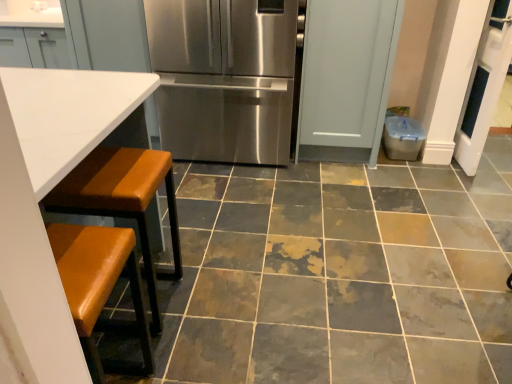
Question: Considering the relative sizes of brown leather stool at lower left and white leather table at left in the image provided, is brown leather stool at lower left shorter than white leather table at left?

Choices:
 (A) yes
 (B) no

Answer: (A)

Question: Is brown leather stool at lower left to the left of white leather table at left from the viewer's perspective?

Choices:
 (A) no
 (B) yes

Answer: (A)

Question: Is brown leather stool at lower left aimed at white leather table at left?

Choices:
 (A) no
 (B) yes

Answer: (B)

Question: Is brown leather stool at lower left smaller than white leather table at left?

Choices:
 (A) no
 (B) yes

Answer: (B)

Question: Is brown leather stool at lower left touching white leather table at left?

Choices:
 (A) no
 (B) yes

Answer: (A)

Question: Considering the positions of stainless steel refrigerator at center and white leather table at left in the image, is stainless steel refrigerator at center wider or thinner than white leather table at left?

Choices:
 (A) wide
 (B) thin

Answer: (B)

Question: Looking at the image, does stainless steel refrigerator at center seem bigger or smaller compared to white leather table at left?

Choices:
 (A) small
 (B) big

Answer: (B)

Question: From a real-world perspective, is stainless steel refrigerator at center positioned above or below white leather table at left?

Choices:
 (A) below
 (B) above

Answer: (B)

Question: Is stainless steel refrigerator at center inside the boundaries of white leather table at left, or outside?

Choices:
 (A) outside
 (B) inside

Answer: (A)

Question: Is white leather table at left in front of or behind marble-like ceramic tile at center in the image?

Choices:
 (A) front
 (B) behind

Answer: (A)

Question: In terms of width, does white leather table at left look wider or thinner when compared to marble-like ceramic tile at center?

Choices:
 (A) wide
 (B) thin

Answer: (B)

Question: In terms of height, does white leather table at left look taller or shorter compared to marble-like ceramic tile at center?

Choices:
 (A) tall
 (B) short

Answer: (A)

Question: Is white leather table at left spatially inside marble-like ceramic tile at center, or outside of it?

Choices:
 (A) inside
 (B) outside

Answer: (B)

Question: From a real-world perspective, is marble-like ceramic tile at center positioned above or below stainless steel refrigerator at center?

Choices:
 (A) below
 (B) above

Answer: (A)

Question: Is marble-like ceramic tile at center inside or outside of stainless steel refrigerator at center?

Choices:
 (A) outside
 (B) inside

Answer: (A)